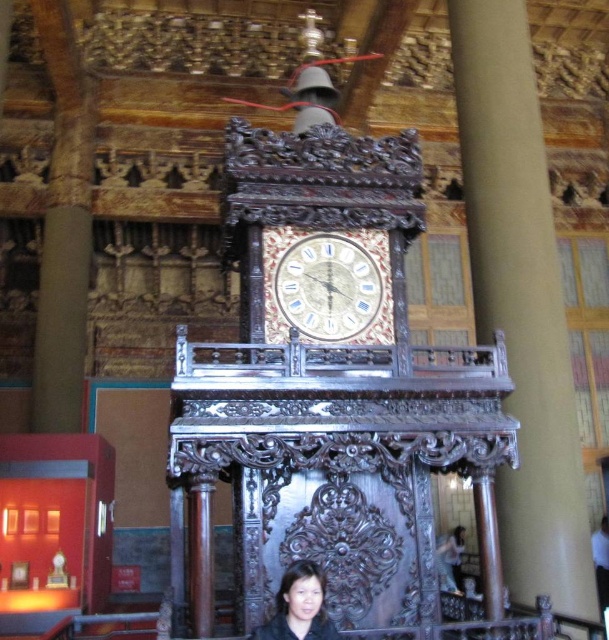
Can you confirm if brown polished wood pillar at center is positioned to the left of smooth beige shirt at lower right?

Correct, you'll find brown polished wood pillar at center to the left of smooth beige shirt at lower right.

Between point (547, 541) and point (600, 524), which one is positioned in front?

Point (547, 541) is in front.

The image size is (609, 640). What do you see at coordinates (521, 301) in the screenshot?
I see `brown polished wood pillar at center` at bounding box center [521, 301].

This screenshot has height=640, width=609. What are the coordinates of `brown polished wood pillar at center` in the screenshot? It's located at (521, 301).

Which is in front, point (283, 616) or point (604, 586)?

Point (283, 616) is in front.

Can you confirm if smooth black hair at lower center is shorter than smooth beige shirt at lower right?

Yes.

At what (x,y) coordinates should I click in order to perform the action: click on smooth black hair at lower center. Please return your answer as a coordinate pair (x, y). The width and height of the screenshot is (609, 640). Looking at the image, I should click on (298, 605).

Can you confirm if gold textured clock at center is wider than smooth black hair at lower center?

Correct, the width of gold textured clock at center exceeds that of smooth black hair at lower center.

Who is more forward, (x=287, y=301) or (x=311, y=604)?

Point (x=311, y=604)

Does point (270, 310) come in front of point (289, 632)?

No.

This screenshot has height=640, width=609. I want to click on gold textured clock at center, so click(x=328, y=285).